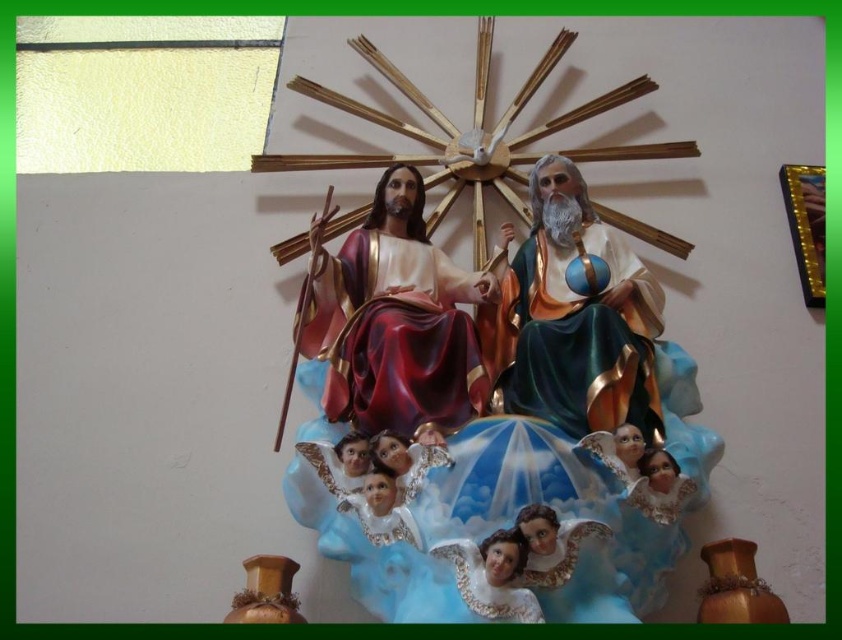
Question: Among these objects, which one is farthest from the camera?

Choices:
 (A) matte plastic sculpture at center
 (B) matte gold statue at center

Answer: (B)

Question: Is shiny red fabric statue at center positioned in front of matte gold statue at center?

Choices:
 (A) yes
 (B) no

Answer: (B)

Question: Is shiny red fabric statue at center smaller than matte gold statue at center?

Choices:
 (A) yes
 (B) no

Answer: (B)

Question: Which is farther from the smooth porcelain angel at center?

Choices:
 (A) matte plastic sculpture at center
 (B) matte gold statue at center
 (C) shiny red fabric statue at center

Answer: (B)

Question: Does matte plastic sculpture at center appear over matte gold statue at center?

Choices:
 (A) yes
 (B) no

Answer: (A)

Question: Which object appears closest to the camera in this image?

Choices:
 (A) matte plastic sculpture at center
 (B) matte gold statue at center
 (C) smooth porcelain angel at center
 (D) shiny red fabric statue at center

Answer: (A)